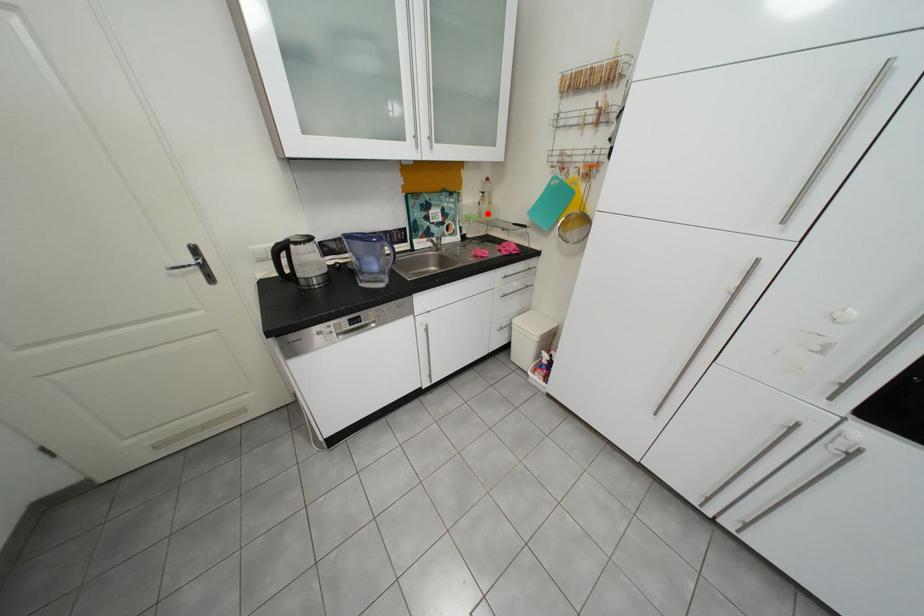
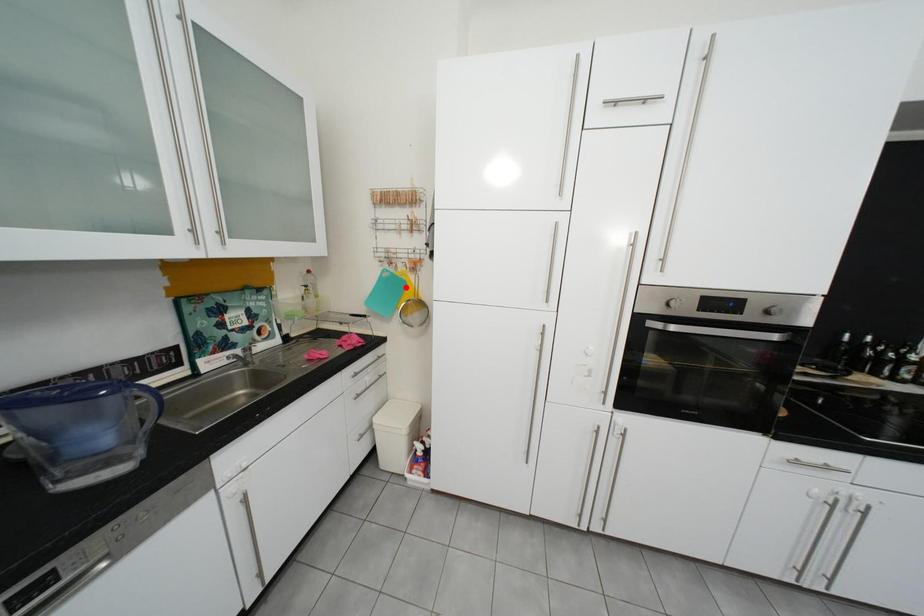
I am providing you with two images of the same scene from different viewpoints. A red point is marked on the first image and another point is marked on the second image. Does the point marked in image1 correspond to the same location as the one in image2?

No